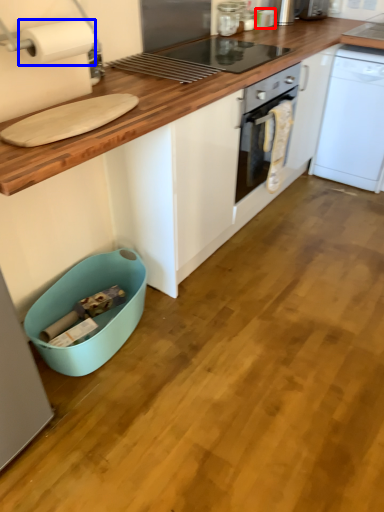
Question: Which of the following is the closest to the observer, appliance (highlighted by a red box) or paper towel (highlighted by a blue box)?

Choices:
 (A) appliance
 (B) paper towel

Answer: (B)